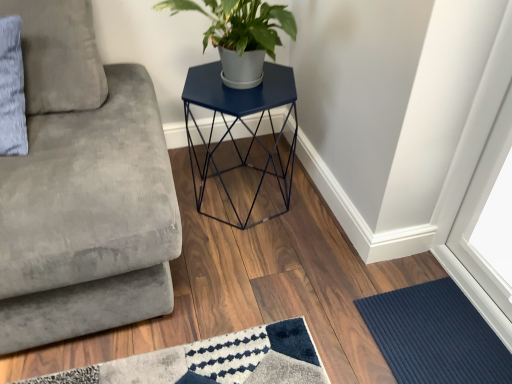
The height and width of the screenshot is (384, 512). In order to click on blank space situated above navy blue ribbed mat at lower right (from a real-world perspective) in this screenshot , I will do `click(434, 326)`.